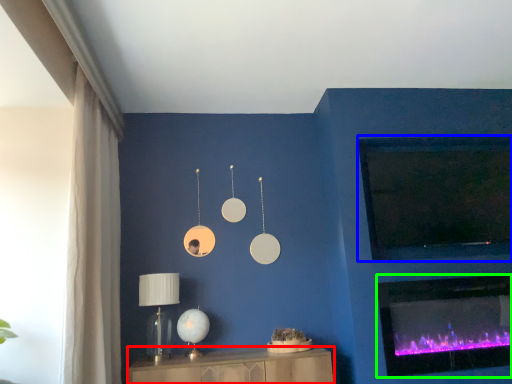
Question: Considering the real-world distances, which object is closest to furniture (highlighted by a red box)? window screen (highlighted by a blue box) or wood burning stove (highlighted by a green box).

Choices:
 (A) window screen
 (B) wood burning stove

Answer: (B)